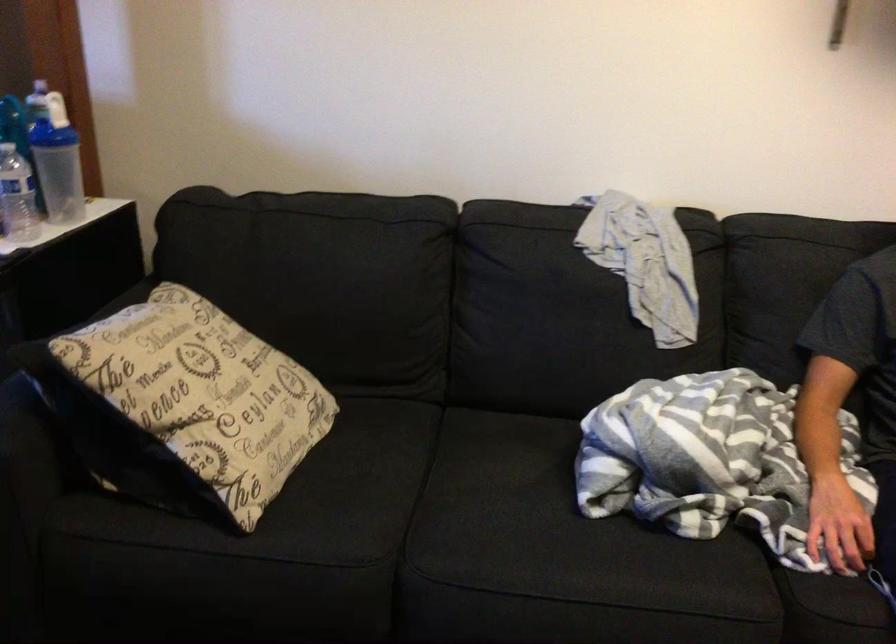
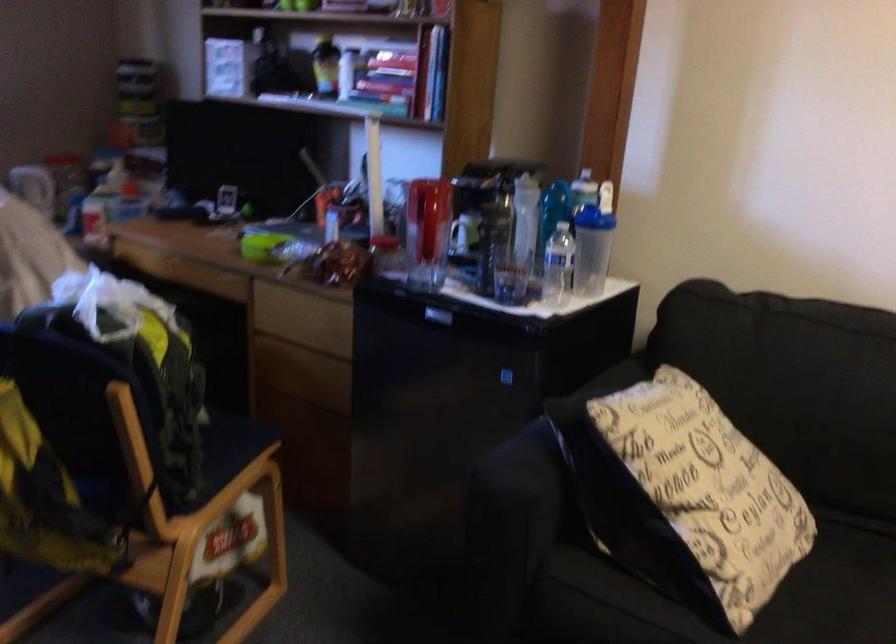
In a continuous first-person perspective shot, in which direction is the camera moving?

The movement direction of the cameraman is left, backward.